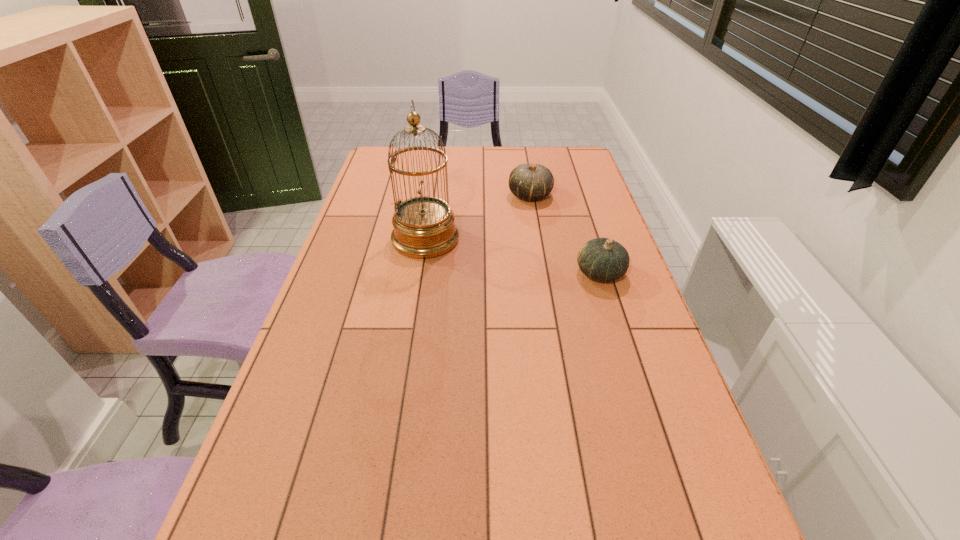
Where is `vacant area that lies between the right gourd and the birdcage`? This screenshot has width=960, height=540. vacant area that lies between the right gourd and the birdcage is located at coordinates (513, 256).

Locate an element on the screen. The image size is (960, 540). free space between the birdcage and the farther gourd is located at coordinates (478, 217).

Identify the location of free spot between the tallest object and the farther gourd. The image size is (960, 540). (478, 217).

Find the location of a particular element. This screenshot has height=540, width=960. free area in between the birdcage and the farthest object is located at coordinates (478, 217).

This screenshot has width=960, height=540. I want to click on empty space that is in between the leftmost object and the rightmost object, so click(513, 256).

Choose which object is the second nearest neighbor to the rightmost object. Please provide its 2D coordinates. Your answer should be formatted as a tuple, i.e. [(x, y)], where the tuple contains the x and y coordinates of a point satisfying the conditions above.

[(424, 227)]

Where is `the closest object to the farther gourd`? The image size is (960, 540). the closest object to the farther gourd is located at coordinates (424, 227).

The width and height of the screenshot is (960, 540). In order to click on free spot that satisfies the following two spatial constraints: 1. on the front side of the rightmost object; 2. on the left side of the farthest object in this screenshot , I will do `click(543, 273)`.

Find the location of a particular element. The height and width of the screenshot is (540, 960). blank area in the image that satisfies the following two spatial constraints: 1. on the back side of the rightmost object; 2. with an open door on the tallest object is located at coordinates (589, 239).

Identify the location of vacant space that satisfies the following two spatial constraints: 1. with an open door on the rightmost object; 2. on the left side of the leftmost object. The width and height of the screenshot is (960, 540). (420, 273).